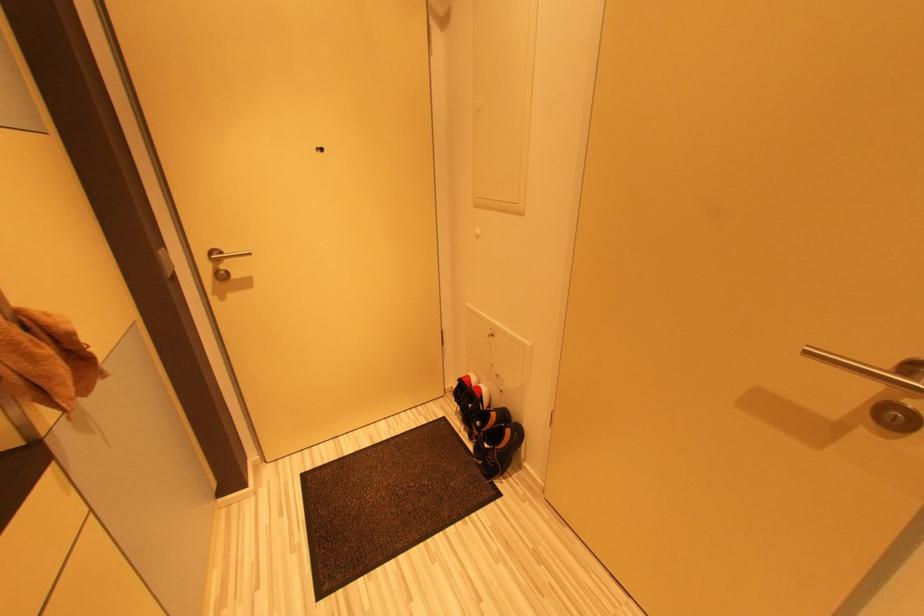
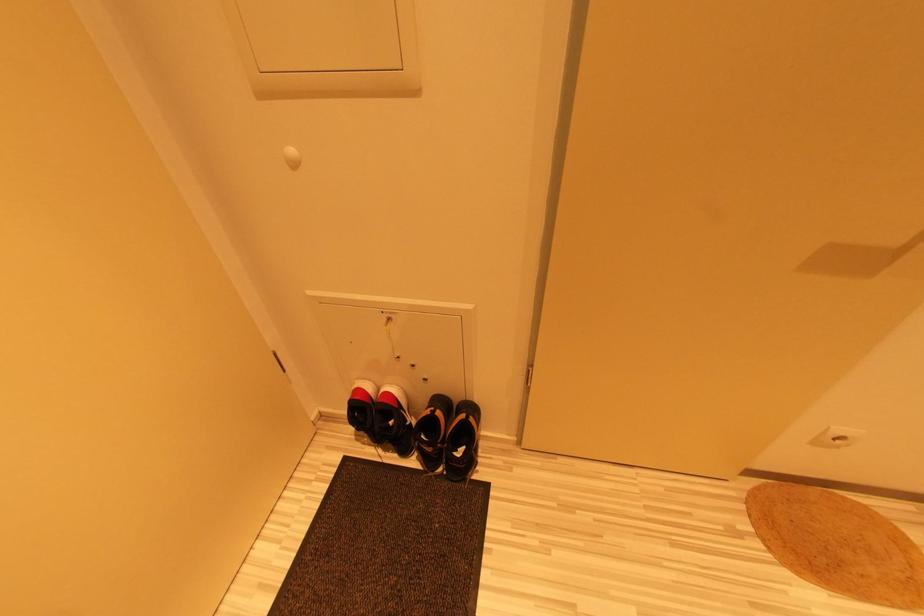
First-person continuous shooting, in which direction is the camera rotating?

The camera's rotation is toward right-down.